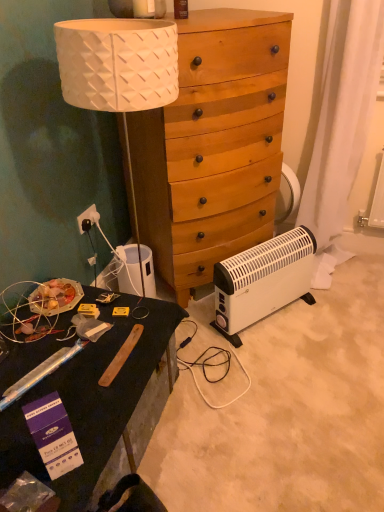
You are a GUI agent. You are given a task and a screenshot of the screen. Output one action in this format:
    pyautogui.click(x=<x>, y=<y>)
    Task: Click on the free point behind purple cardboard box at lower left
    The height and width of the screenshot is (512, 384).
    Given the screenshot: What is the action you would take?
    pyautogui.click(x=89, y=398)